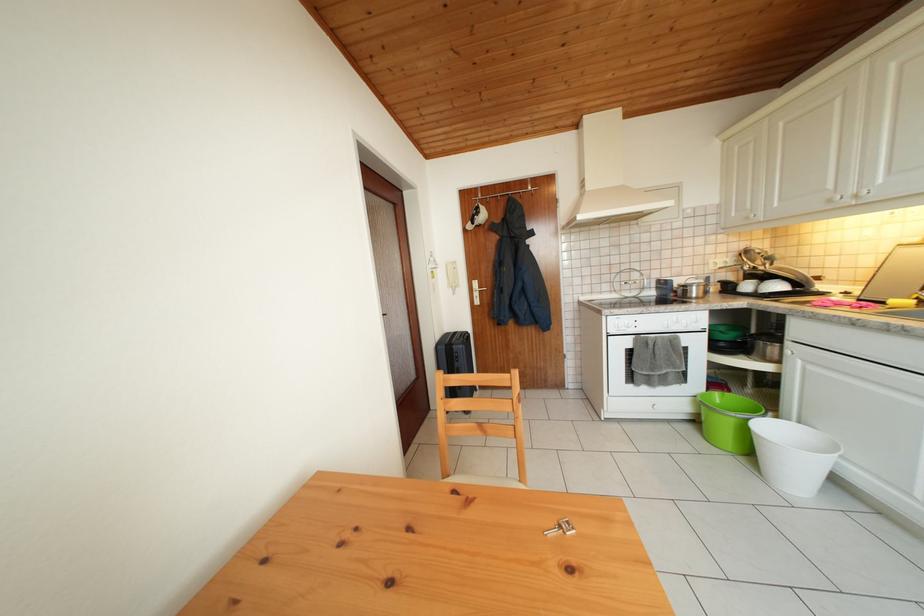
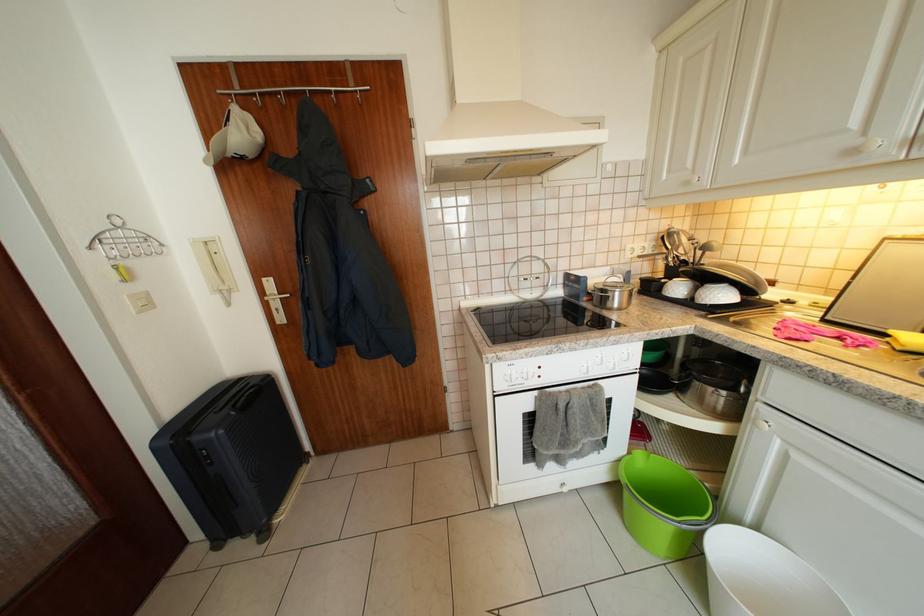
Locate, in the second image, the point that corresponds to [724,399] in the first image.

(648, 459)